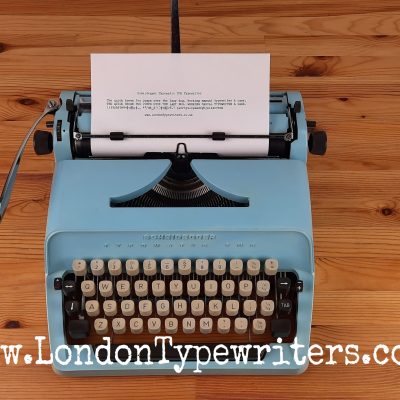
You are a GUI agent. You are given a task and a screenshot of the screen. Output one action in this format:
    pyautogui.click(x=<x>, y=<y>)
    Task: Click on the table
    The height and width of the screenshot is (400, 400).
    Given the screenshot: What is the action you would take?
    pyautogui.click(x=358, y=183)